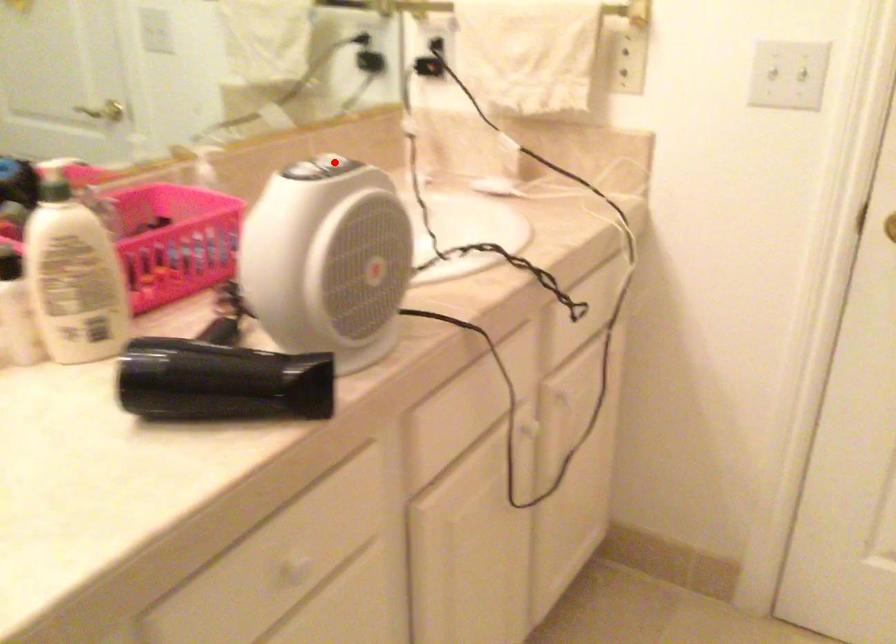
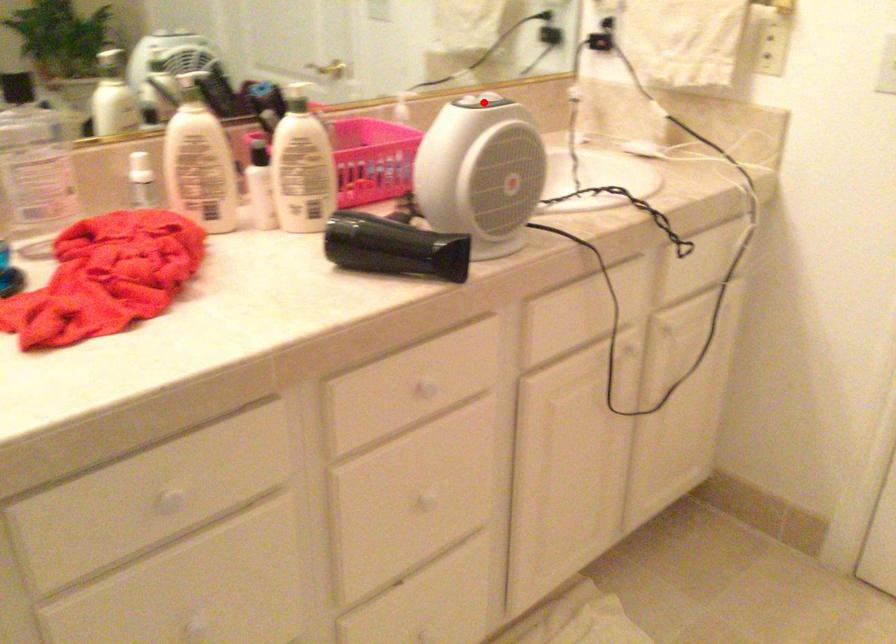
I am providing you with two images of the same scene from different viewpoints. A red point is marked on the first image and another point is marked on the second image. Are the points marked in image1 and image2 representing the same 3D position?

Yes